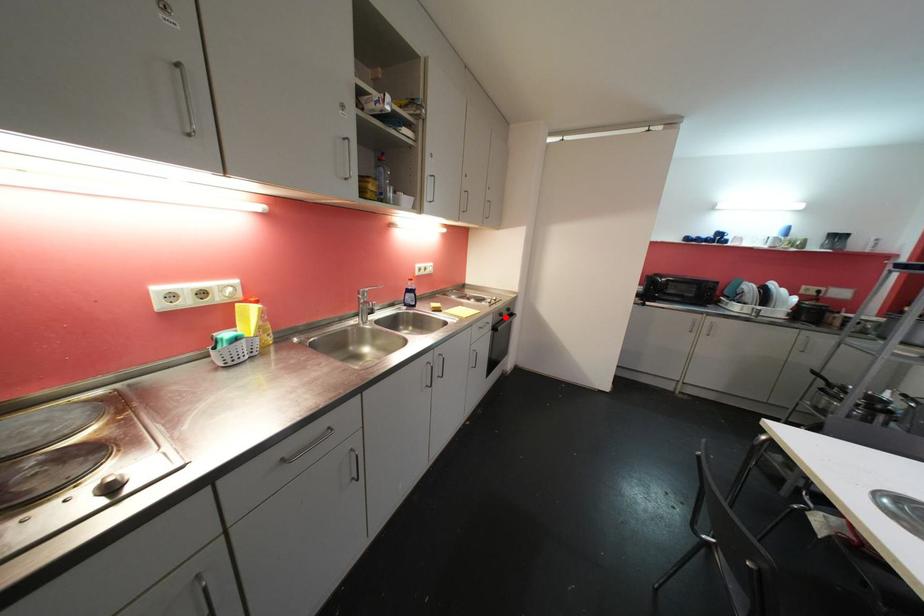
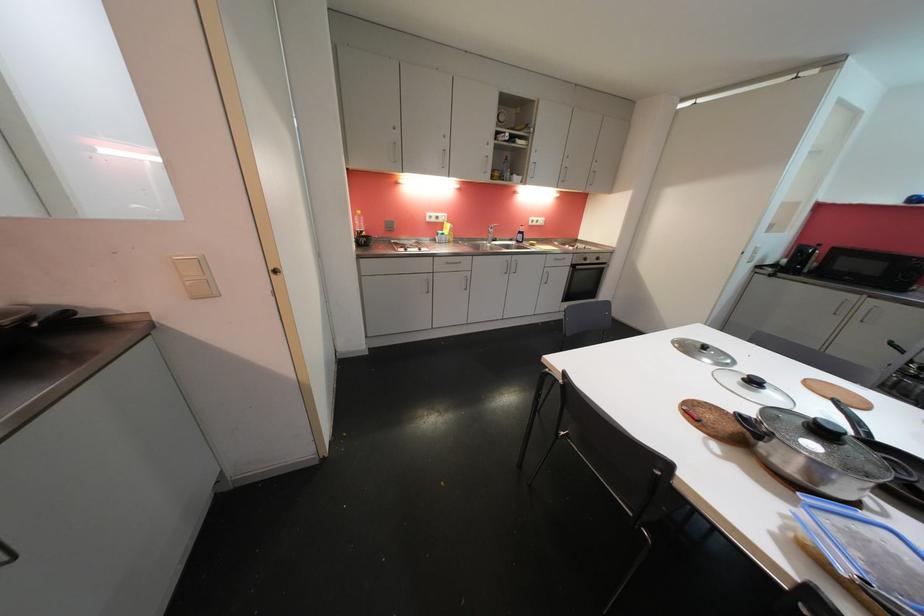
Question: I am providing you with two images of the same scene from different viewpoints. Image1 has a red point marked. In image2, the corresponding 3D location appears at what relative position? Reply with the corresponding letter.

Choices:
 (A) Closer
 (B) Farther

Answer: (A)